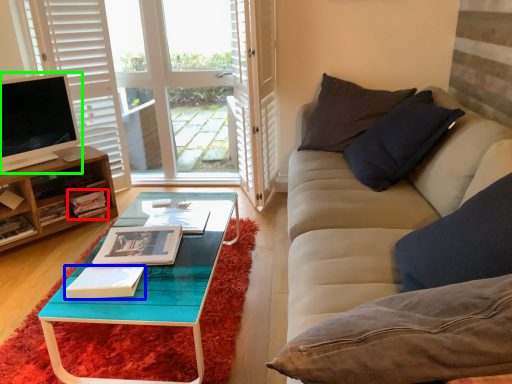
Question: Estimate the real-world distances between objects in this image. Which object is closer to book (highlighted by a red box), book (highlighted by a blue box) or television (highlighted by a green box)?

Choices:
 (A) book
 (B) television

Answer: (B)